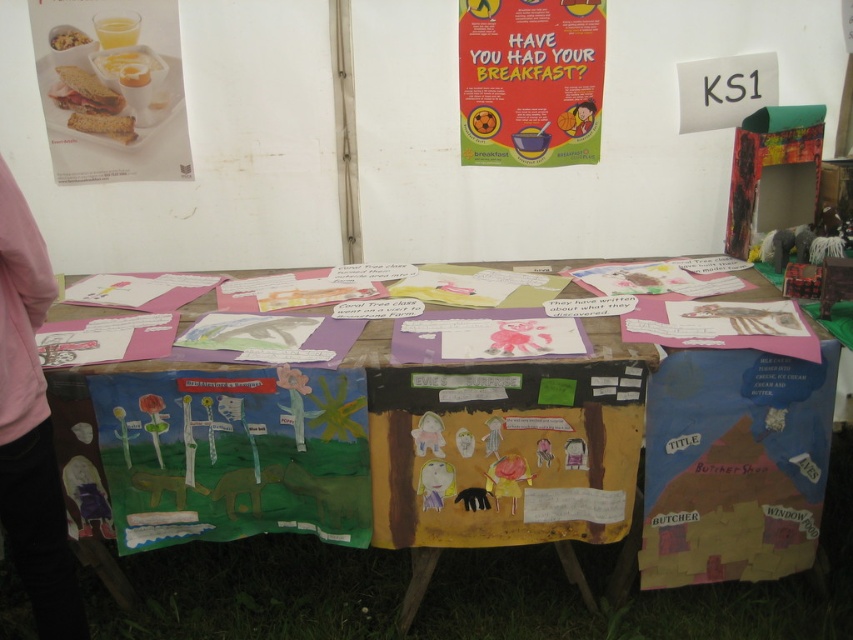
Between point (532, 372) and point (65, 48), which one is positioned in front?

Positioned in front is point (532, 372).

Is wooden table at center above matte plastic bowl at upper left?

No, wooden table at center is not above matte plastic bowl at upper left.

Does point (393, 396) come farther from viewer compared to point (57, 48)?

No.

I want to click on wooden table at center, so click(410, 440).

Based on the photo, can you confirm if pink fabric at left is taller than matte white toast at upper left?

Yes.

Can you confirm if pink fabric at left is bigger than matte white toast at upper left?

Correct, pink fabric at left is larger in size than matte white toast at upper left.

Is point (7, 225) farther from camera compared to point (119, 100)?

No, (7, 225) is in front of (119, 100).

This screenshot has width=853, height=640. Find the location of `pink fabric at left`. pink fabric at left is located at coordinates (30, 426).

Is point (408, 513) farther from camera compared to point (589, 141)?

No, it is not.

Between wooden table at center and red paper poster at upper center, which one has less height?

red paper poster at upper center

Locate an element on the screen. The height and width of the screenshot is (640, 853). wooden table at center is located at coordinates (410, 440).